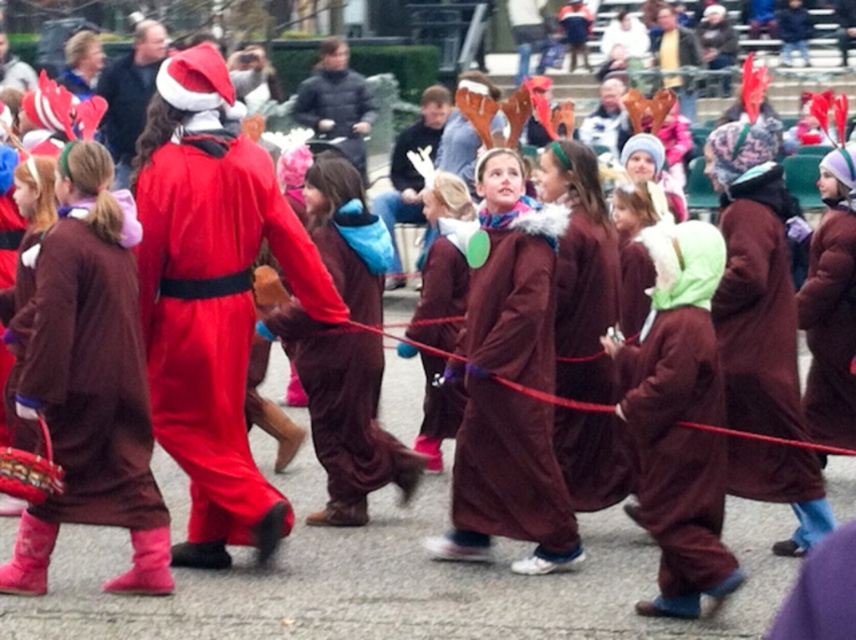
Between velvet santa claus at center and brown velvet robe at center, which one is positioned higher?

velvet santa claus at center

Is velvet santa claus at center taller than brown velvet robe at center?

Yes.

The width and height of the screenshot is (856, 640). What are the coordinates of `velvet santa claus at center` in the screenshot? It's located at (211, 300).

Can you confirm if brown velvet robe at center is wider than brown fuzzy coat at center?

Incorrect, brown velvet robe at center's width does not surpass brown fuzzy coat at center's.

Is brown velvet robe at center above brown fuzzy coat at center?

Actually, brown velvet robe at center is below brown fuzzy coat at center.

What are the coordinates of `brown velvet robe at center` in the screenshot? It's located at (510, 396).

Is the position of brown fuzzy robe at center less distant than that of brown fuzzy coat at center?

Yes, it is in front of brown fuzzy coat at center.

What do you see at coordinates (90, 374) in the screenshot? I see `brown fuzzy robe at center` at bounding box center [90, 374].

Locate an element on the screen. Image resolution: width=856 pixels, height=640 pixels. brown fuzzy robe at center is located at coordinates (90, 374).

In order to click on brown fuzzy robe at center in this screenshot , I will do `click(90, 374)`.